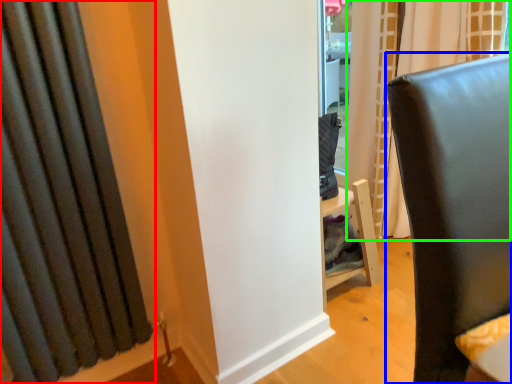
Question: Considering the real-world distances, which object is closest to curtain (highlighted by a red box)? furniture (highlighted by a blue box) or curtain (highlighted by a green box).

Choices:
 (A) furniture
 (B) curtain

Answer: (A)